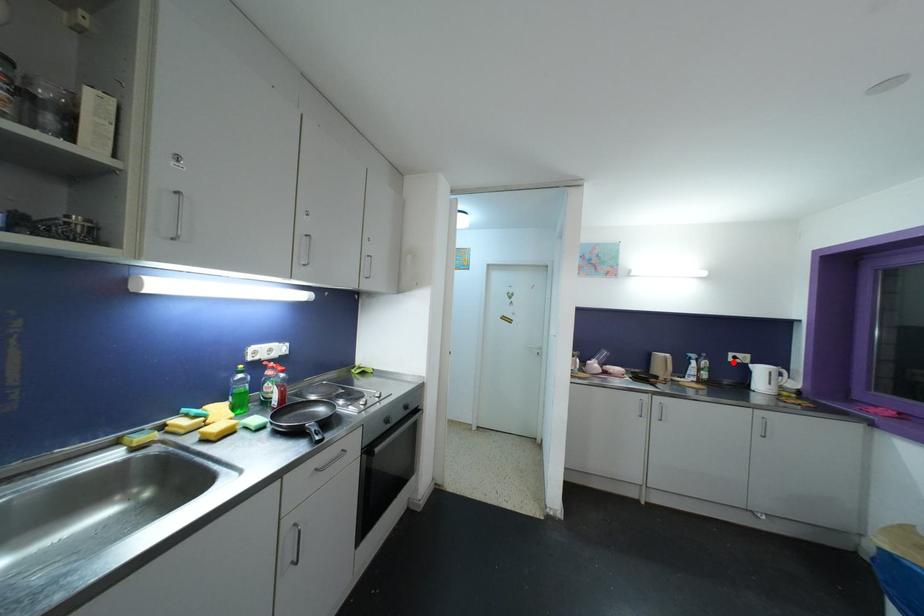
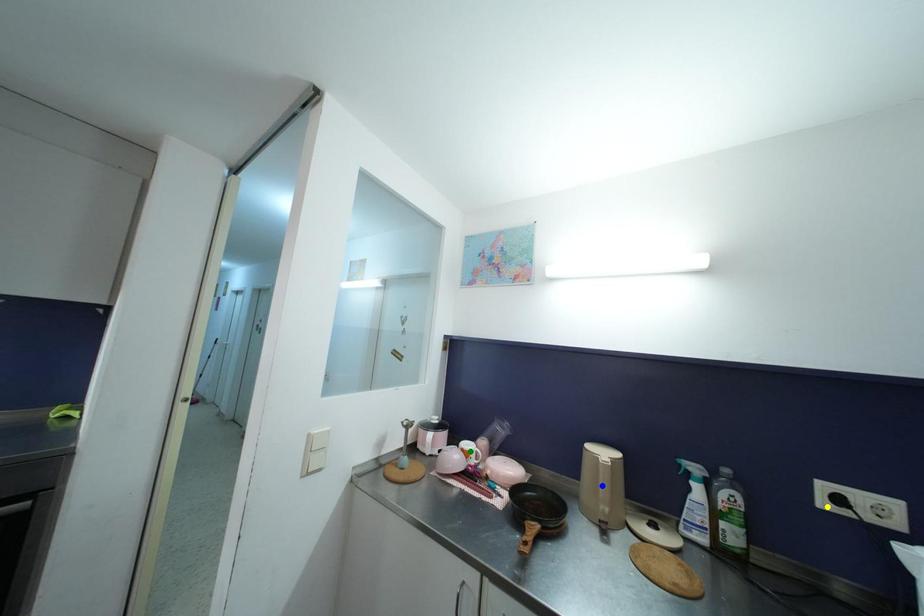
Question: I am providing you with two images of the same scene from different viewpoints. A red point is marked on the first image. You are given multiple points on the second image. Which point in image 2 represents the same 3d spot as the red point in image 1?

Choices:
 (A) yellow point
 (B) green point
 (C) blue point

Answer: (A)